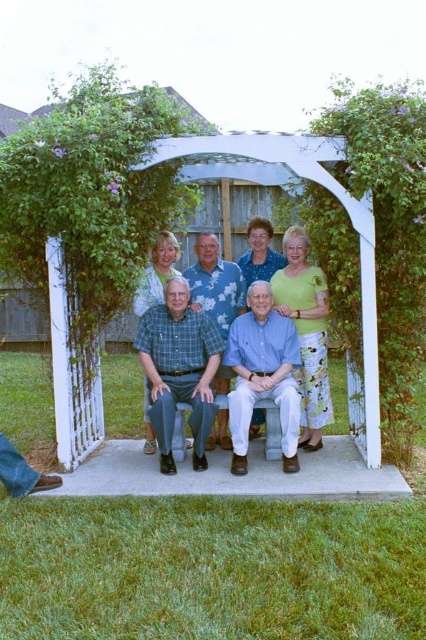
You are a photographer standing at the camera position. You want to adjust your focus to capture the blue plaid shirt at center clearly. What is the minimum focusing distance you need to set?

The minimum focusing distance you need to set is 4.89 meters to capture the blue plaid shirt at center clearly.

In the photo under the arbor, there are two men wearing a green checkered shirt at center and a blue cotton shirt at center. Which one is standing to the left?

The green checkered shirt at center is positioned on the left side of blue cotton shirt at center, so the man in the green checkered shirt at center is standing to the left of the blue cotton shirt at center.

In the photo under the arbor with purple flowers, there is a point marked at coordinates (178, 369). What object in the scene corresponds to that point?

The point at (178, 369) corresponds to the green checkered shirt at center.